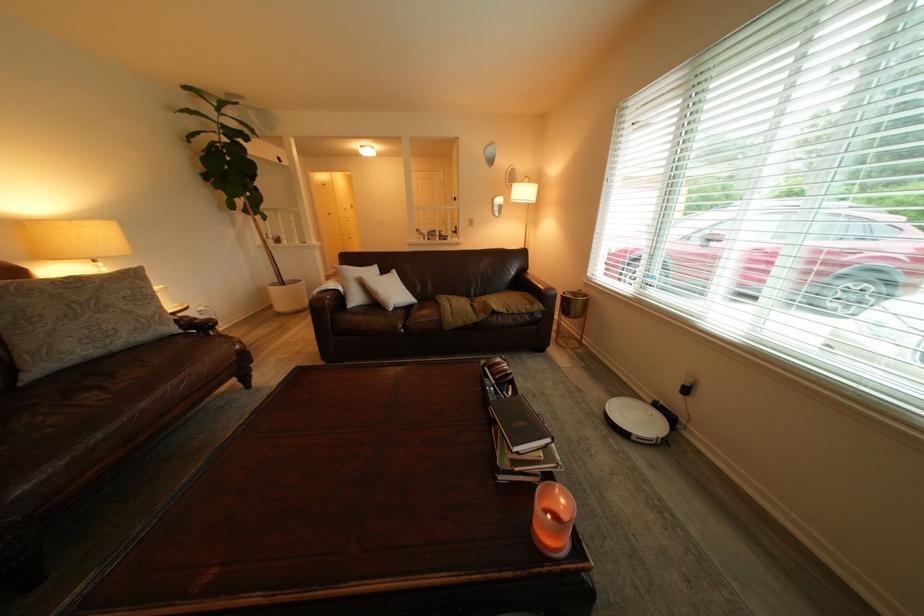
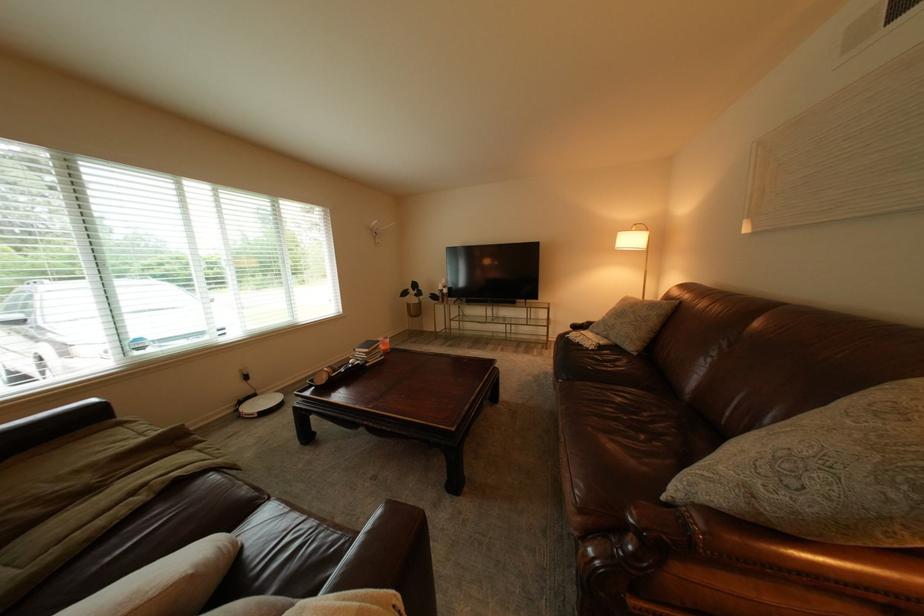
Where in the second image is the point corresponding to pixel 687 419 from the first image?

(269, 397)